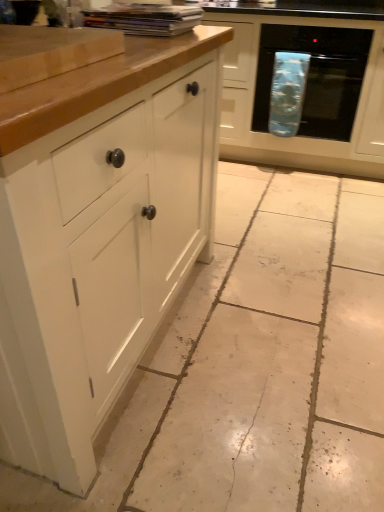
This screenshot has height=512, width=384. I want to click on free spot above white tile floor at center (from a real-world perspective), so click(x=277, y=261).